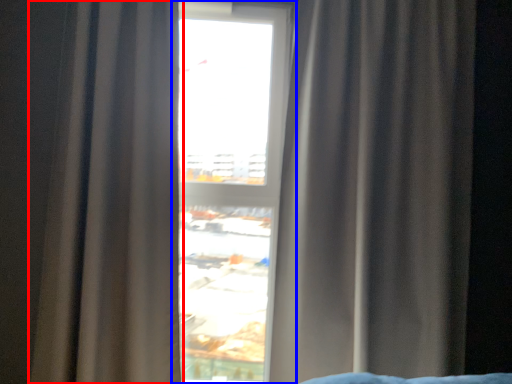
Question: Which object is further to the camera taking this photo, curtain (highlighted by a red box) or window (highlighted by a blue box)?

Choices:
 (A) curtain
 (B) window

Answer: (B)